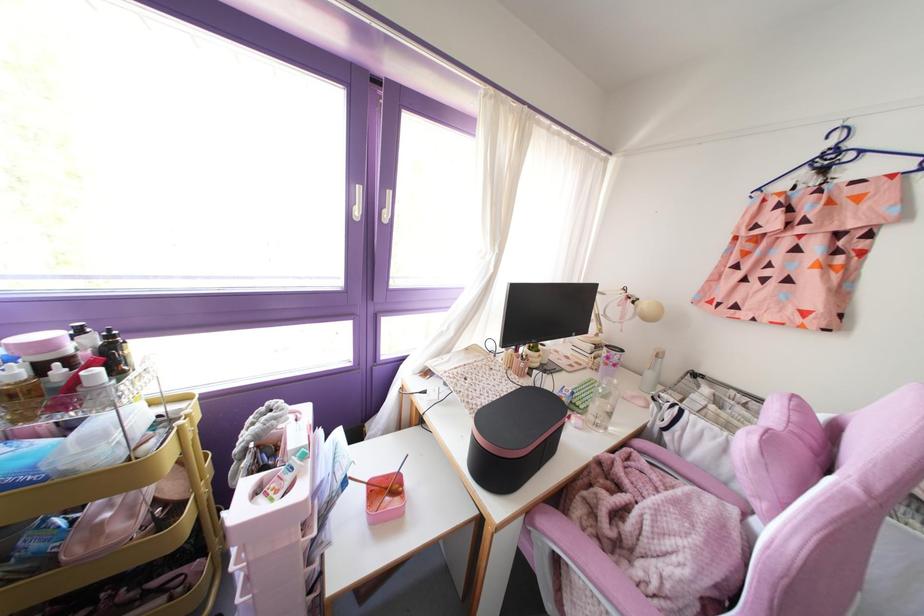
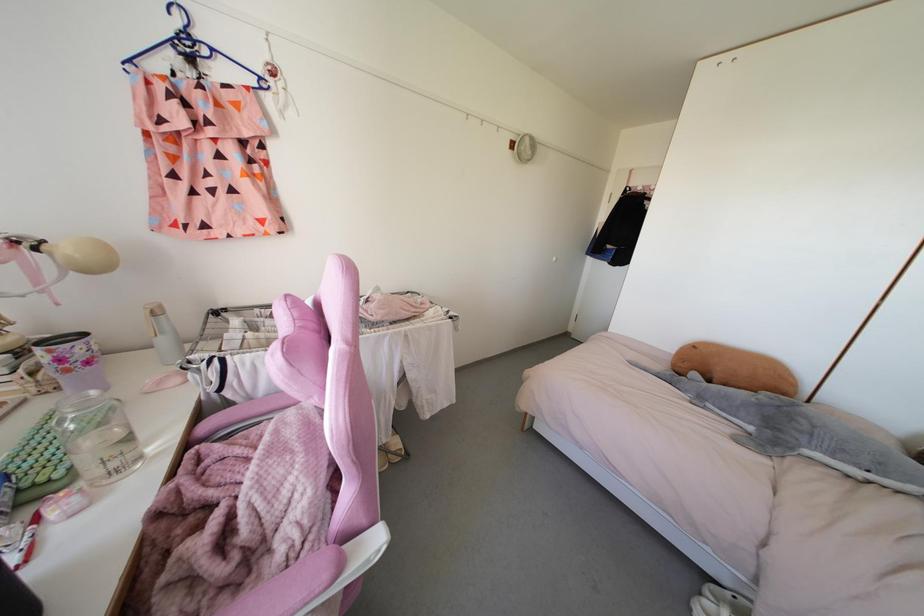
The point at (614, 381) is marked in the first image. Where is the corresponding point in the second image?

(92, 392)